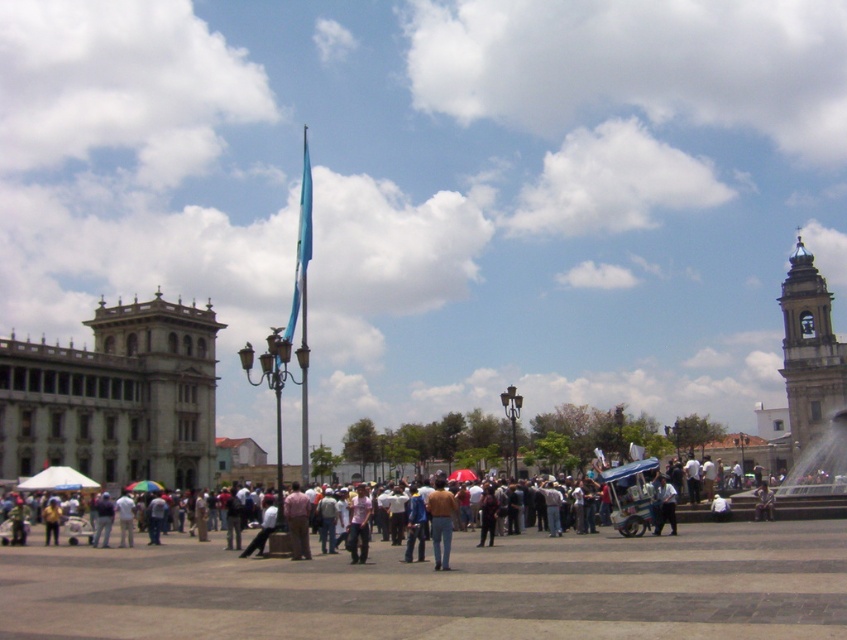
You are a tourist standing in the public square and want to take a photo of both the gold metallic bell tower at right and the metallic fountain at right. Since you can only focus on one object at a time, which one should you aim your camera at first to ensure both are in the frame?

The gold metallic bell tower at right is located above the metallic fountain at right, so you should aim your camera at the metallic fountain at right first to ensure both are in the frame.

You are a tourist in the square and want to take a photo of both the gold metallic bell tower at right and the metallic fountain at right. Which object should you position yourself to the left of to ensure both are in the frame?

You should position yourself to the left of the metallic fountain at right. Since the gold metallic bell tower at right is to the right of the metallic fountain at right, placing yourself left of the fountain will allow both objects to be captured in the photo.